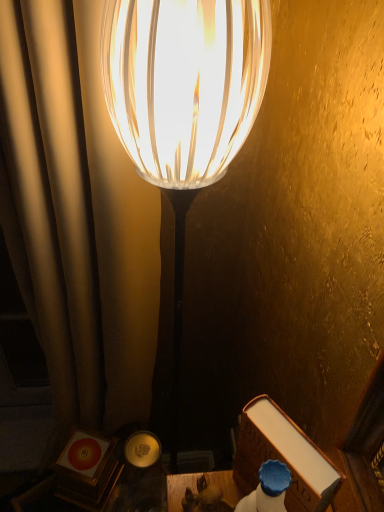
Question: Based on their positions, is wooden table at lower center located to the left or right of brown leather book at lower right?

Choices:
 (A) right
 (B) left

Answer: (B)

Question: From a real-world perspective, relative to brown leather book at lower right, is wooden table at lower center vertically above or below?

Choices:
 (A) below
 (B) above

Answer: (A)

Question: Estimate the real-world distances between objects in this image. Which object is farther from the translucent glass lamp at center?

Choices:
 (A) wooden table at lower center
 (B) brown leather book at lower right

Answer: (A)

Question: Considering the real-world distances, which object is farthest from the translucent glass lamp at center?

Choices:
 (A) wooden table at lower center
 (B) brown leather book at lower right

Answer: (A)